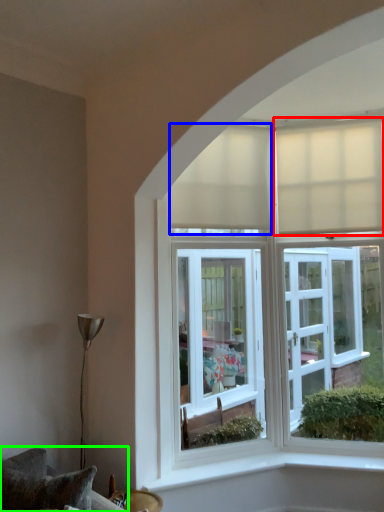
Question: Based on their relative distances, which object is nearer to curtain (highlighted by a red box)? Choose from curtain (highlighted by a blue box) and furniture (highlighted by a green box).

Choices:
 (A) curtain
 (B) furniture

Answer: (A)